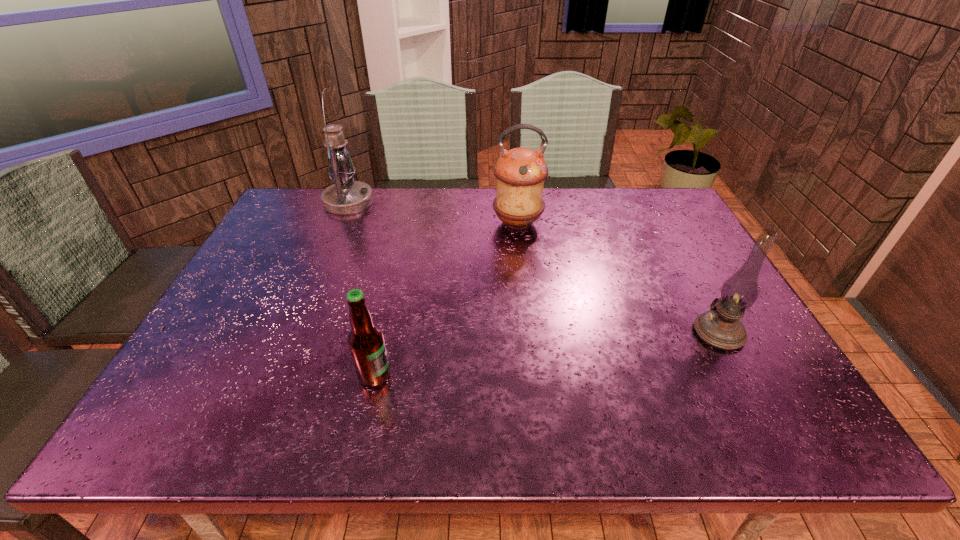
Select which oil lamp is the second closest to the leftmost oil lamp. Please provide its 2D coordinates. Your answer should be formatted as a tuple, i.e. [(x, y)], where the tuple contains the x and y coordinates of a point satisfying the conditions above.

[(720, 327)]

This screenshot has height=540, width=960. Find the location of `the closest oil lamp relative to the rightmost object`. the closest oil lamp relative to the rightmost object is located at coordinates (520, 172).

Image resolution: width=960 pixels, height=540 pixels. I want to click on vacant area that satisfies the following two spatial constraints: 1. on the front side of the second object from right to left; 2. on the right side of the third farthest object, so click(x=530, y=332).

Find the location of a particular element. This screenshot has width=960, height=540. vacant region that satisfies the following two spatial constraints: 1. on the front side of the third object from left to right; 2. on the right side of the third farthest object is located at coordinates (530, 332).

Find the location of a particular element. free space that satisfies the following two spatial constraints: 1. on the front side of the leftmost object; 2. on the right side of the third farthest object is located at coordinates (293, 332).